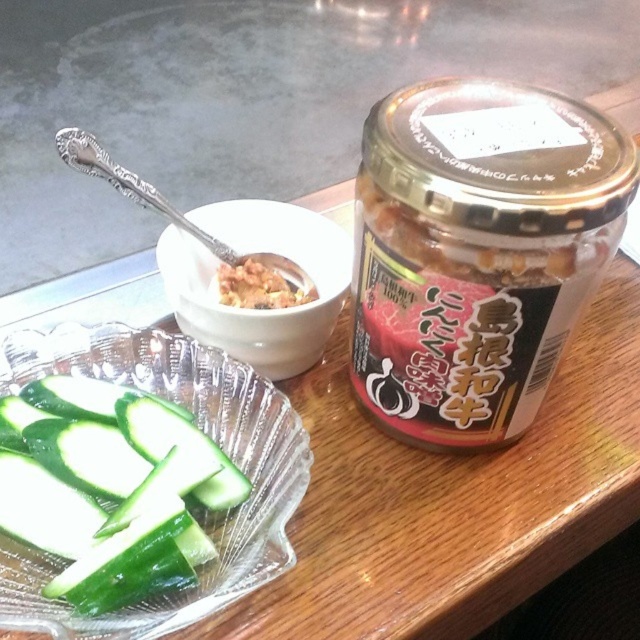
Is white ceramic bowl at center to the left of white creamy paste at center from the viewer's perspective?

Indeed, white ceramic bowl at center is positioned on the left side of white creamy paste at center.

Is white ceramic bowl at center shorter than white creamy paste at center?

In fact, white ceramic bowl at center may be taller than white creamy paste at center.

You are a GUI agent. You are given a task and a screenshot of the screen. Output one action in this format:
    pyautogui.click(x=<x>, y=<y>)
    Task: Click on the white ceramic bowl at center
    The width and height of the screenshot is (640, 640).
    Given the screenshot: What is the action you would take?
    252,308

Is transparent glass jar at right shorter than green smooth cucumber at lower left?

No, transparent glass jar at right is not shorter than green smooth cucumber at lower left.

Can you confirm if transparent glass jar at right is wider than green smooth cucumber at lower left?

Indeed, transparent glass jar at right has a greater width compared to green smooth cucumber at lower left.

Identify the location of transparent glass jar at right. The image size is (640, 640). (477, 250).

In order to click on transparent glass jar at right in this screenshot , I will do `click(477, 250)`.

The height and width of the screenshot is (640, 640). What do you see at coordinates (477, 250) in the screenshot?
I see `transparent glass jar at right` at bounding box center [477, 250].

Between point (468, 125) and point (310, 352), which one is positioned behind?

Point (310, 352)

Between point (458, 314) and point (320, 253), which one is positioned behind?

The point (320, 253) is more distant.

At what (x,y) coordinates should I click in order to perform the action: click on transparent glass jar at right. Please return your answer as a coordinate pair (x, y). Image resolution: width=640 pixels, height=640 pixels. Looking at the image, I should click on (477, 250).